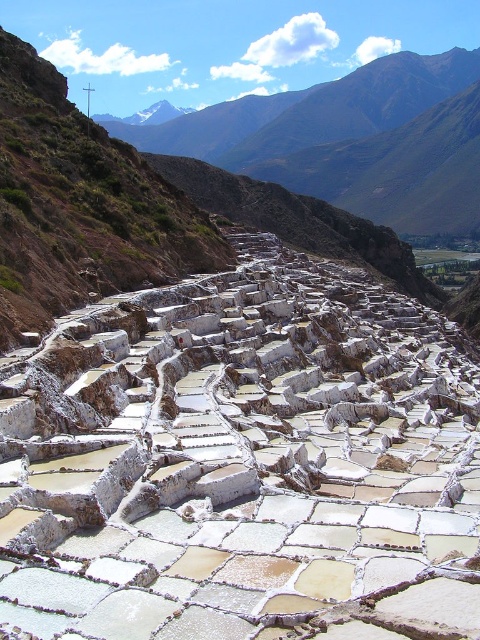
Question: Which point appears closest to the camera in this image?

Choices:
 (A) (166, 582)
 (B) (444, 179)

Answer: (A)

Question: Is white stone at center to the left of rugged brown mountain at upper center from the viewer's perspective?

Choices:
 (A) yes
 (B) no

Answer: (A)

Question: Which point is closer to the camera taking this photo?

Choices:
 (A) (172, 346)
 (B) (436, 122)

Answer: (A)

Question: Can you confirm if white stone at center is bigger than rugged brown mountain at upper center?

Choices:
 (A) no
 (B) yes

Answer: (A)

Question: Is white stone at center to the right of rugged brown mountain at upper center from the viewer's perspective?

Choices:
 (A) no
 (B) yes

Answer: (A)